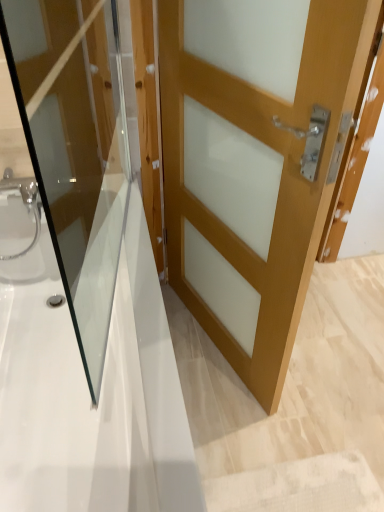
Question: Considering the positions of point (107, 329) and point (299, 249), is point (107, 329) closer or farther from the camera than point (299, 249)?

Choices:
 (A) closer
 (B) farther

Answer: (B)

Question: Relative to light brown wood door at center, which ranks as the 2th door in left-to-right order, is matte wood door at center, placed as the first door when sorted from left to right, in front or behind?

Choices:
 (A) behind
 (B) front

Answer: (B)

Question: Which object is positioned farthest from the matte wood door at center, placed as the first door when sorted from left to right?

Choices:
 (A) white glossy bathtub at center
 (B) light brown wood door at center, which ranks as the 2th door in left-to-right order

Answer: (B)

Question: Which of these objects is positioned closest to the light brown wood door at center, the first door in the right-to-left sequence?

Choices:
 (A) white glossy bathtub at center
 (B) matte wood door at center, which appears as the second door when viewed from the right

Answer: (B)